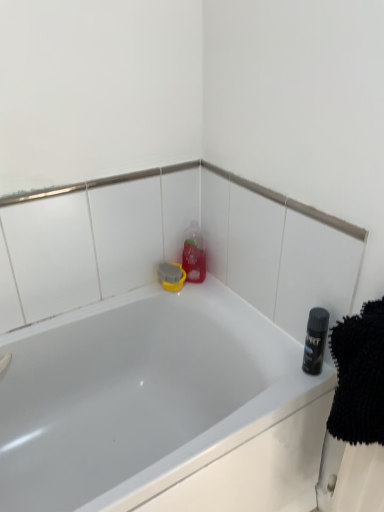
The image size is (384, 512). Identify the location of vacant area that lies in front of translucent plastic bottle at upper center. (214, 300).